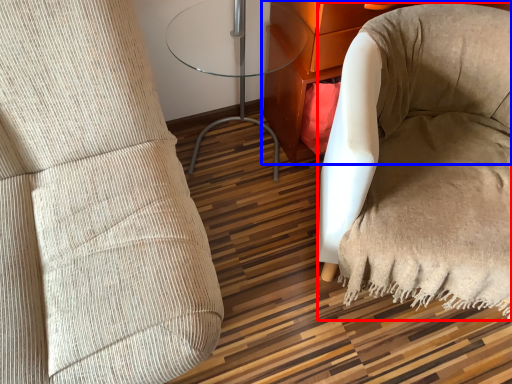
Question: Which object appears farthest to the camera in this image, bean bag chair (highlighted by a red box) or furniture (highlighted by a blue box)?

Choices:
 (A) bean bag chair
 (B) furniture

Answer: (B)